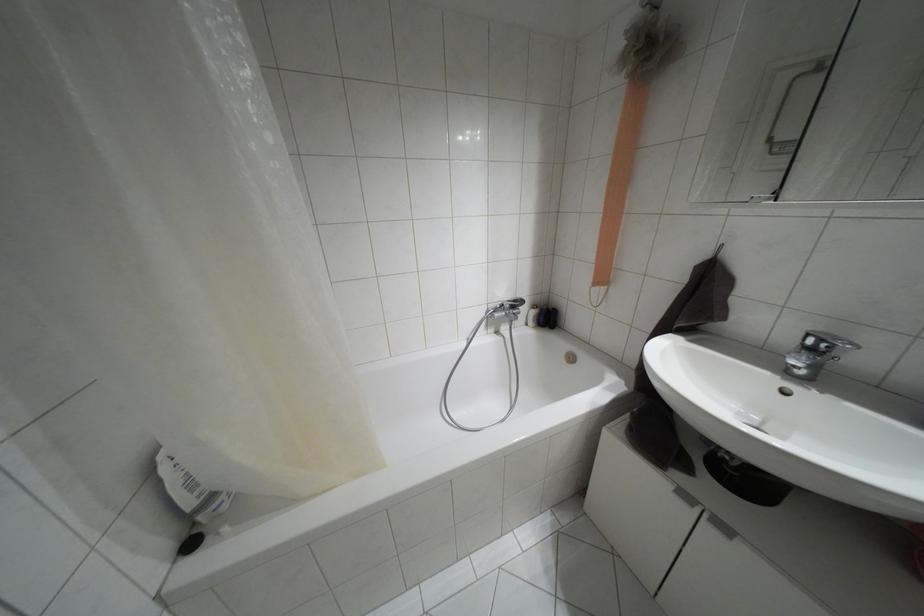
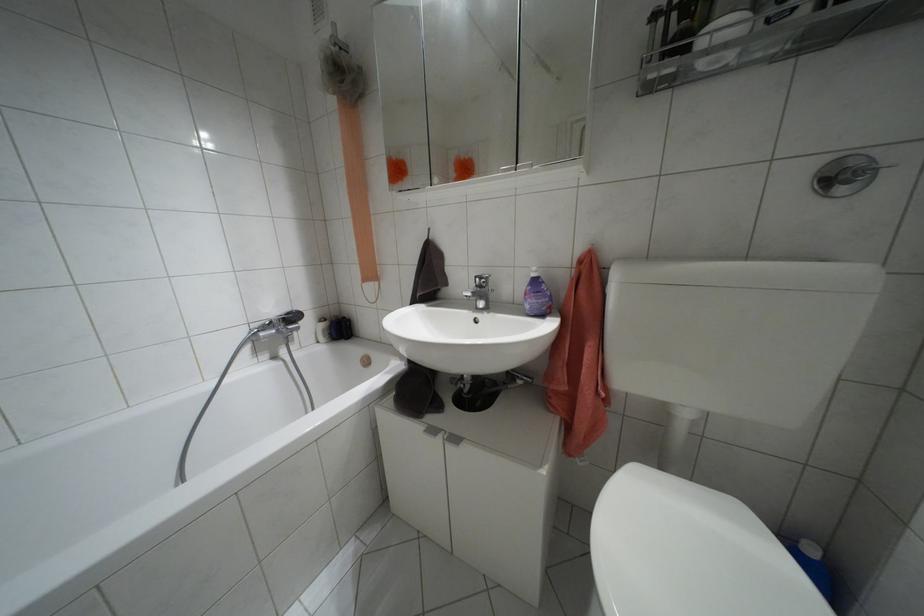
Question: The camera is either moving clockwise (left) or counter-clockwise (right) around the object. The first image is from the beginning of the video and the second image is from the end. Is the camera moving left or right when shooting the video?

Choices:
 (A) Left
 (B) Right

Answer: (A)